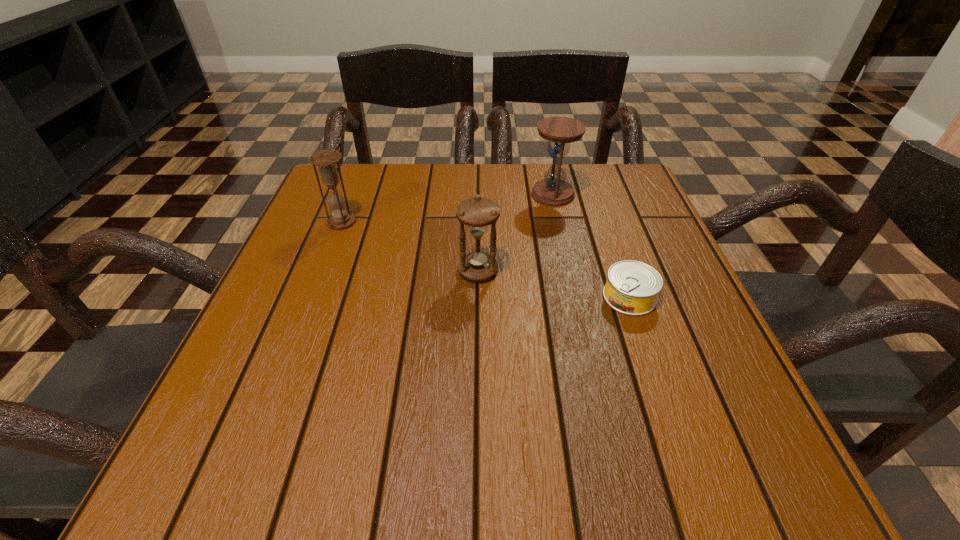
I want to click on free space at the near right corner of the desktop, so click(x=700, y=467).

Find the location of a particular element. This screenshot has height=540, width=960. free space between the shortest object and the nearest hourglass is located at coordinates (554, 284).

Locate an element on the screen. The width and height of the screenshot is (960, 540). blank region between the shortest object and the third object from right to left is located at coordinates click(x=554, y=284).

At what (x,y) coordinates should I click in order to perform the action: click on vacant point located between the farthest hourglass and the second farthest object. Please return your answer as a coordinate pair (x, y). Looking at the image, I should click on (447, 208).

Find the location of a particular element. Image resolution: width=960 pixels, height=540 pixels. free spot between the farthest object and the third object from right to left is located at coordinates (516, 233).

Where is `vacant area between the second farthest object and the farthest hourglass`? Image resolution: width=960 pixels, height=540 pixels. vacant area between the second farthest object and the farthest hourglass is located at coordinates (x=447, y=208).

Locate an element on the screen. Image resolution: width=960 pixels, height=540 pixels. free space between the second hourglass from left to right and the farthest hourglass is located at coordinates (516, 233).

The image size is (960, 540). In order to click on free space between the rightmost hourglass and the nearest hourglass in this screenshot , I will do click(x=516, y=233).

Locate an element on the screen. free space between the rightmost hourglass and the leftmost hourglass is located at coordinates (447, 208).

This screenshot has height=540, width=960. What are the coordinates of `unoccupied position between the farthest hourglass and the nearest hourglass` in the screenshot? It's located at (516, 233).